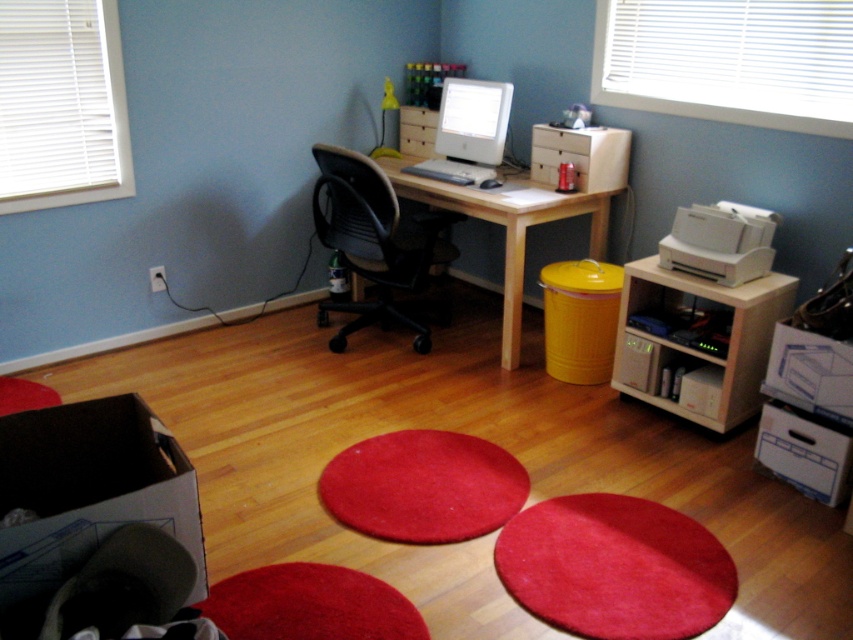
You are standing in the home office and want to know which of the two points, point (764, 252) or point (471, 131), is closer to you. Can you determine this based on the setup?

Point (764, 252) is closer to the camera than point (471, 131), so it is closer to you.

You are organizing cables in the home office and need to connect the white plastic printer at right to the white glossy desktop computer at center. Which object is closer to you if you are standing in front of the desk?

The white plastic printer at right is closer to you since it is in front of the white glossy desktop computer at center.

You are setting up a new printer in your home office. You have a space that can only accommodate items up to 15 cm in thickness. The white plastic printer at right and the white glossy desktop computer at center are both candidates for placement. Which one can fit in the space based on their thickness?

The white plastic printer at right is thinner than the white glossy desktop computer at center, so the white plastic printer at right can fit in the 15 cm thickness space.